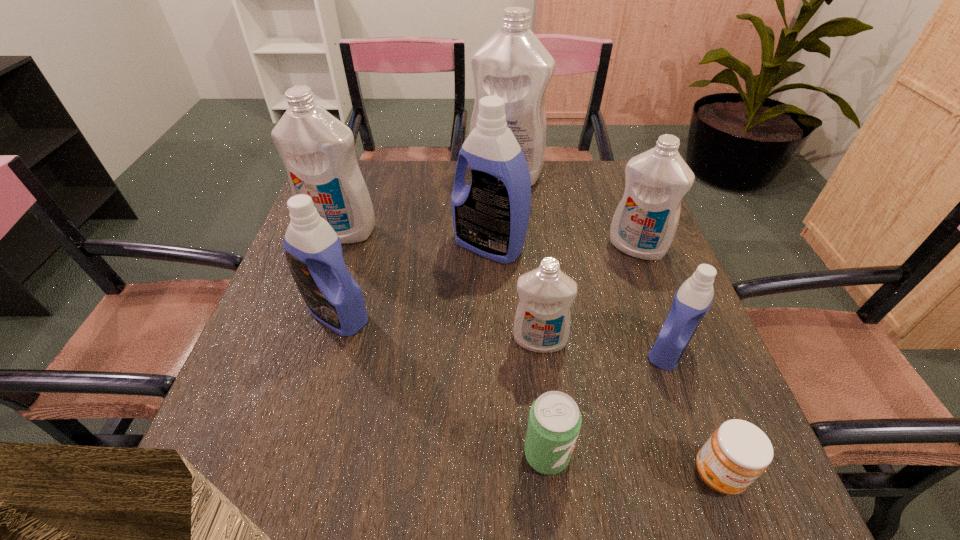
This screenshot has width=960, height=540. Identify the location of object located in the far edge section of the desktop. [513, 64].

This screenshot has width=960, height=540. Identify the location of soda located at the near edge. (554, 423).

Locate an element on the screen. jam that is positioned at the near edge is located at coordinates (738, 452).

Find the location of a particular element. The height and width of the screenshot is (540, 960). jam located at the right edge is located at coordinates click(738, 452).

This screenshot has width=960, height=540. What are the coordinates of `object that is at the near right corner` in the screenshot? It's located at (738, 452).

Where is `free space at the far edge of the desktop`? free space at the far edge of the desktop is located at coordinates (413, 171).

This screenshot has width=960, height=540. I want to click on vacant space at the left edge of the desktop, so click(312, 387).

This screenshot has width=960, height=540. Identify the location of vacant region at the right edge of the desktop. (595, 219).

In the image, there is a desktop. Where is `blank space at the far right corner`? The width and height of the screenshot is (960, 540). blank space at the far right corner is located at coordinates (614, 180).

Where is `free space between the farthest blue detergent and the rightmost blue detergent`? free space between the farthest blue detergent and the rightmost blue detergent is located at coordinates (579, 298).